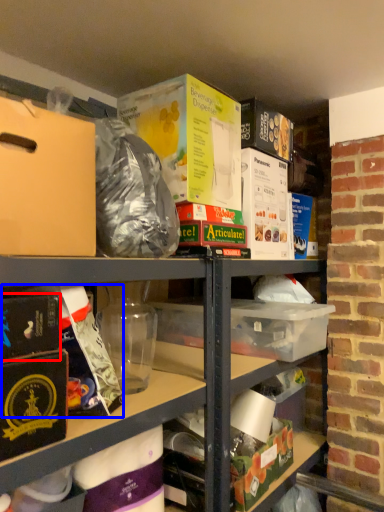
Question: Which object appears closest to the camera in this image, paperback book (highlighted by a red box) or wrapping paper (highlighted by a blue box)?

Choices:
 (A) paperback book
 (B) wrapping paper

Answer: (A)